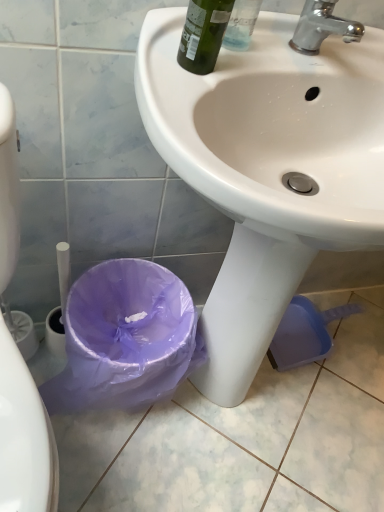
Image resolution: width=384 pixels, height=512 pixels. What are the coordinates of `free space in front of purple plastic bag at lower left` in the screenshot? It's located at (119, 461).